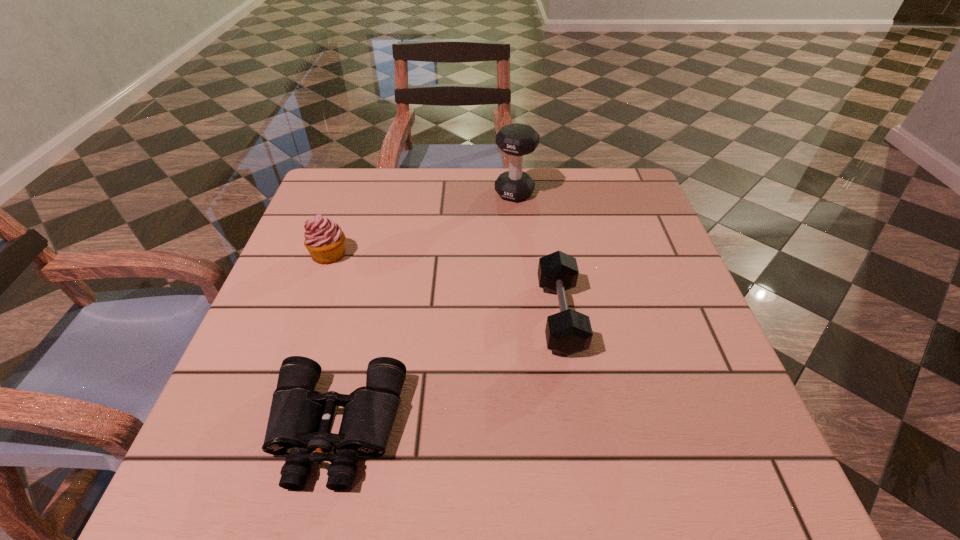
The image size is (960, 540). What are the coordinates of `free space at the near left corner` in the screenshot? It's located at (266, 488).

At what (x,y) coordinates should I click in order to perform the action: click on vacant space at the far right corner. Please return your answer as a coordinate pair (x, y). This screenshot has height=540, width=960. Looking at the image, I should click on (616, 188).

Where is `vacant space at the near right corner of the desktop`? This screenshot has height=540, width=960. vacant space at the near right corner of the desktop is located at coordinates (711, 448).

You are a GUI agent. You are given a task and a screenshot of the screen. Output one action in this format:
    pyautogui.click(x=<x>, y=<y>)
    Task: Click on the free space between the nearest object and the shorter dumbbell
    The height and width of the screenshot is (540, 960).
    Given the screenshot: What is the action you would take?
    pyautogui.click(x=448, y=372)

The height and width of the screenshot is (540, 960). Identify the location of empty space that is in between the binoculars and the third farthest object. (448, 372).

Identify the location of free space between the second shortest object and the farthest object. pyautogui.click(x=537, y=254).

I want to click on free area in between the shorter dumbbell and the farthest object, so click(x=537, y=254).

At what (x,y) coordinates should I click in order to perform the action: click on vacant space that is in between the third nearest object and the nearest object. Please return your answer as a coordinate pair (x, y). The image size is (960, 540). Looking at the image, I should click on (333, 341).

In order to click on vacant area between the shorter dumbbell and the farther dumbbell in this screenshot , I will do point(537,254).

Find the location of a particular element. This screenshot has width=960, height=540. vacant space that is in between the nearest object and the cupcake is located at coordinates 333,341.